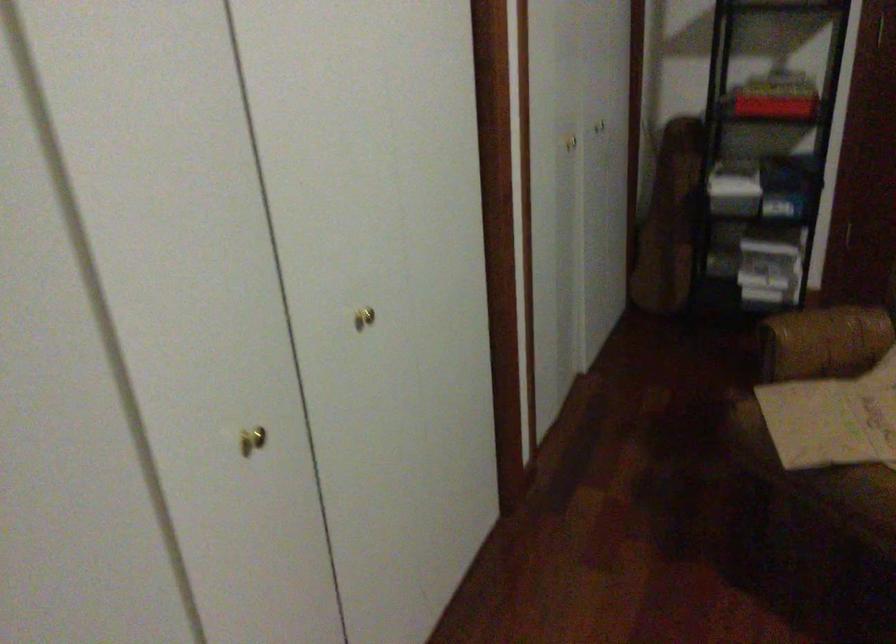
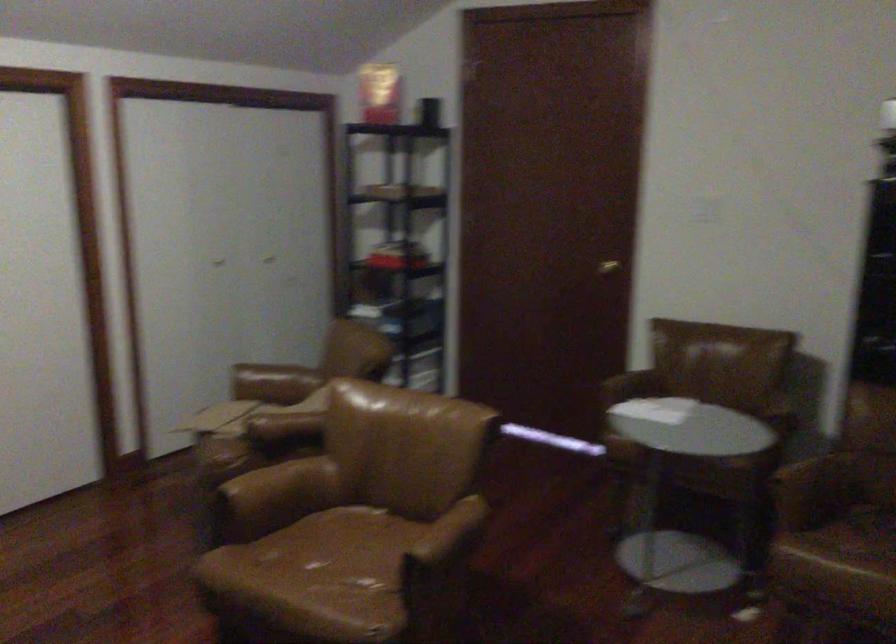
What movement of the cameraman would produce the second image?

The cameraman moved toward right, backward.